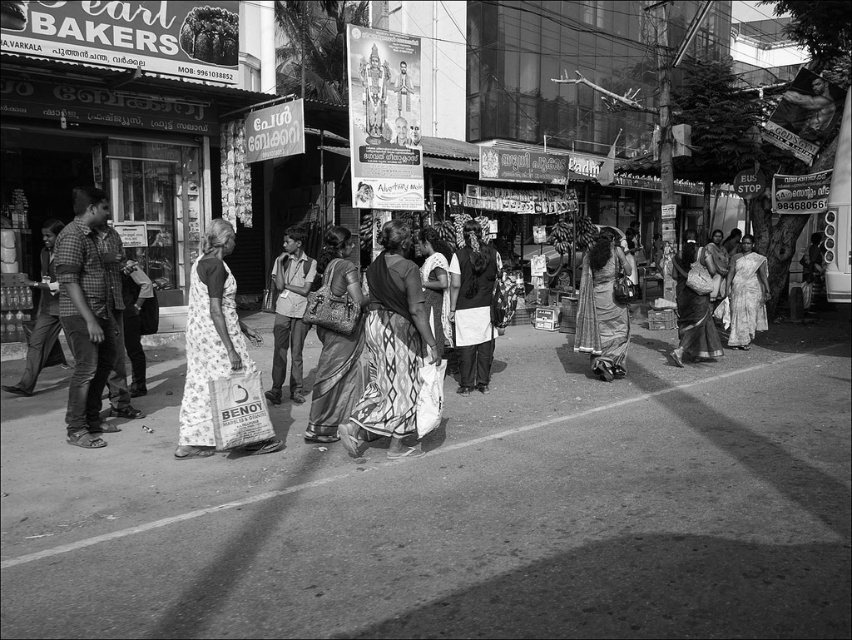
Consider the image. Does silky gold saree at center have a larger size compared to white floral saree at right?

No.

The height and width of the screenshot is (640, 852). What do you see at coordinates (334, 381) in the screenshot?
I see `silky gold saree at center` at bounding box center [334, 381].

Find the location of a particular element. silky gold saree at center is located at coordinates (334, 381).

You are a GUI agent. You are given a task and a screenshot of the screen. Output one action in this format:
    pyautogui.click(x=<x>, y=<y>)
    Task: Click on the silky gold saree at center
    This screenshot has height=640, width=852.
    Given the screenshot: What is the action you would take?
    pyautogui.click(x=334, y=381)

Who is more distant from viewer, (419, 349) or (746, 275)?

The point (746, 275) is more distant.

Between point (360, 412) and point (751, 340), which one is positioned behind?

The point (751, 340) is more distant.

This screenshot has width=852, height=640. I want to click on printed cotton saree at center, so click(x=392, y=348).

From the picture: Can you confirm if printed cotton saree at center is positioned to the left of silky gold saree at center?

Incorrect, printed cotton saree at center is not on the left side of silky gold saree at center.

Which is more to the left, printed cotton saree at center or silky gold saree at center?

From the viewer's perspective, silky gold saree at center appears more on the left side.

Who is more forward, [370,433] or [331,406]?

Positioned in front is point [370,433].

What are the coordinates of `printed cotton saree at center` in the screenshot? It's located at (392, 348).